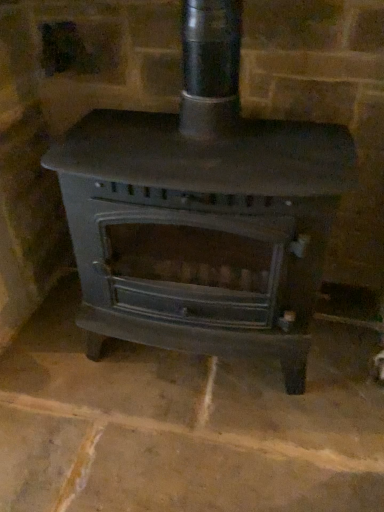
Locate an element on the screen. The height and width of the screenshot is (512, 384). vacant area situated to the left side of matte black wood burning stove at center is located at coordinates (48, 371).